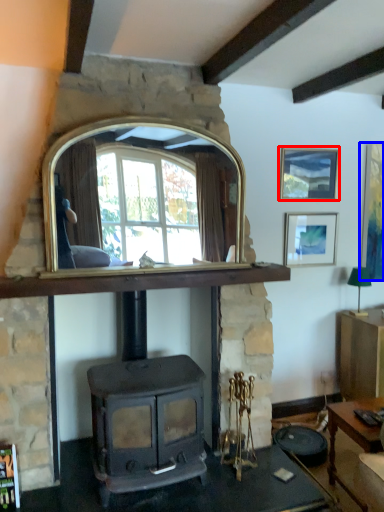
Question: Which object is further to the camera taking this photo, picture frame (highlighted by a red box) or picture frame (highlighted by a blue box)?

Choices:
 (A) picture frame
 (B) picture frame

Answer: (B)